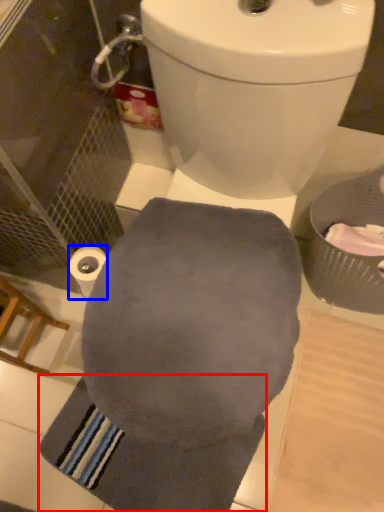
Question: Which of the following is the closest to the observer, bath towel (highlighted by a red box) or toilet paper (highlighted by a blue box)?

Choices:
 (A) bath towel
 (B) toilet paper

Answer: (B)